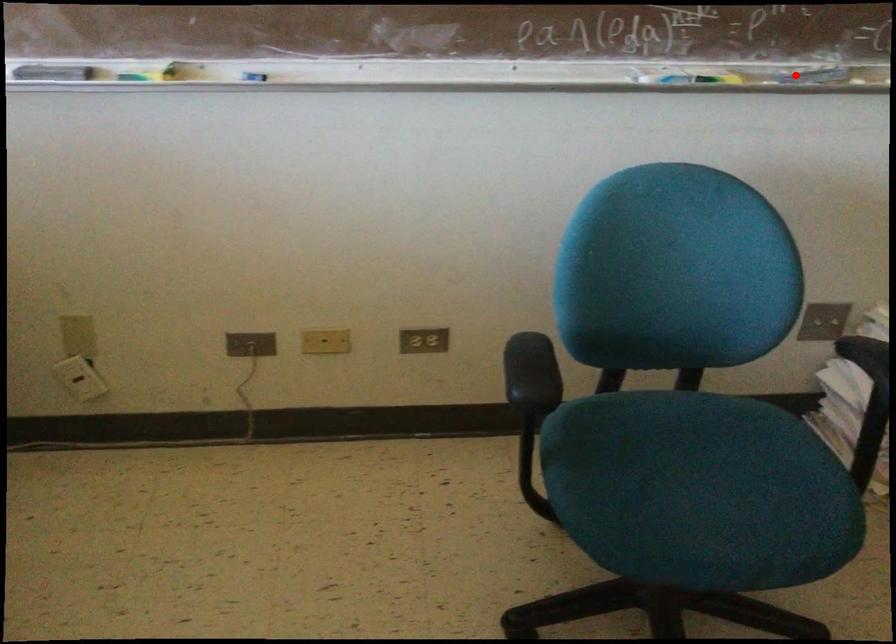
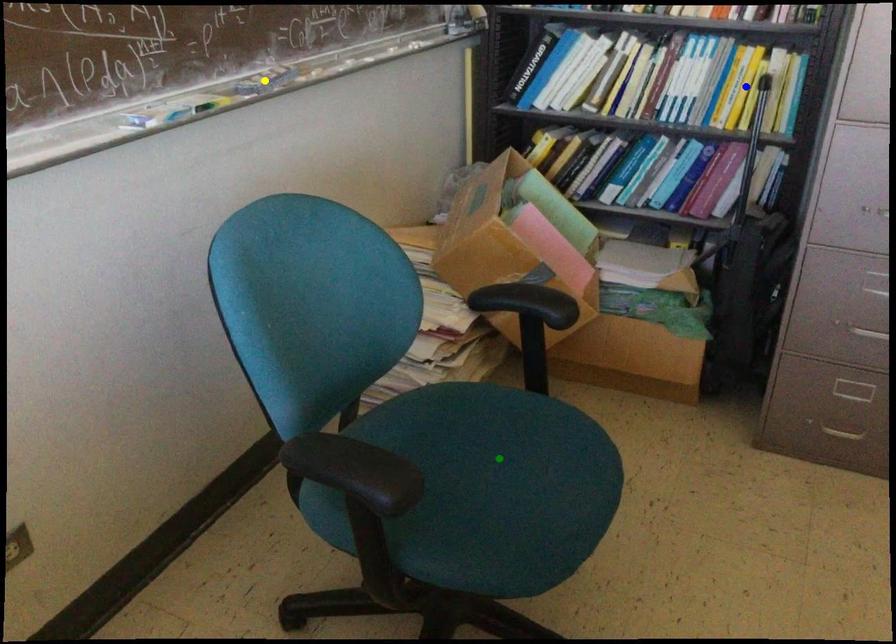
Question: I am providing you with two images of the same scene from different viewpoints. A red point is marked on the first image. You are given multiple points on the second image. Which point in image 2 represents the same 3d spot as the red point in image 1?

Choices:
 (A) blue point
 (B) green point
 (C) yellow point

Answer: (C)